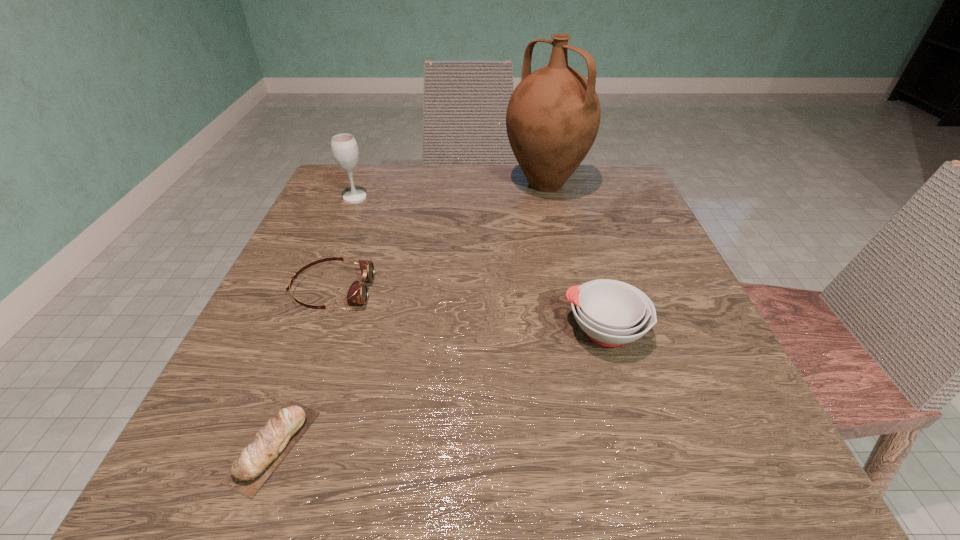
Locate an element on the screen. This screenshot has height=540, width=960. unoccupied area between the pitcher and the goggles is located at coordinates (439, 238).

I want to click on unoccupied area between the third tallest object and the pita bread, so 439,388.

Find the location of a particular element. This screenshot has height=540, width=960. free spot between the pita bread and the goggles is located at coordinates (302, 368).

The image size is (960, 540). In order to click on empty location between the nearest object and the goggles in this screenshot , I will do `click(302, 368)`.

At what (x,y) coordinates should I click in order to perform the action: click on vacant area between the goggles and the nearest object. Please return your answer as a coordinate pair (x, y). The height and width of the screenshot is (540, 960). Looking at the image, I should click on pyautogui.click(x=302, y=368).

At what (x,y) coordinates should I click in order to perform the action: click on blank region between the soup bowl and the nearest object. Please return your answer as a coordinate pair (x, y). The width and height of the screenshot is (960, 540). Looking at the image, I should click on (439, 388).

Identify the location of free space between the goggles and the tallest object. (439, 238).

Find the location of a particular element. This screenshot has height=540, width=960. vacant area that lies between the wineglass and the goggles is located at coordinates pyautogui.click(x=344, y=244).

You are a GUI agent. You are given a task and a screenshot of the screen. Output one action in this format:
    pyautogui.click(x=<x>, y=<y>)
    Task: Click on the vacant space in between the pitcher and the wineglass
    The width and height of the screenshot is (960, 540).
    Given the screenshot: What is the action you would take?
    pyautogui.click(x=450, y=191)

Find the location of a particular element. This screenshot has width=960, height=540. object that stands as the closest to the fourth tallest object is located at coordinates (259, 459).